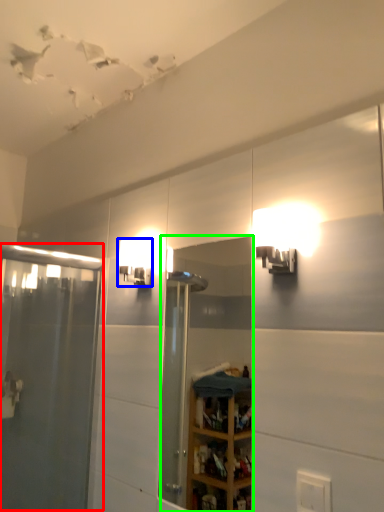
Question: Considering the real-world distances, which object is farthest from screen door (highlighted by a red box)? light fixture (highlighted by a blue box) or mirror (highlighted by a green box)?

Choices:
 (A) light fixture
 (B) mirror

Answer: (B)